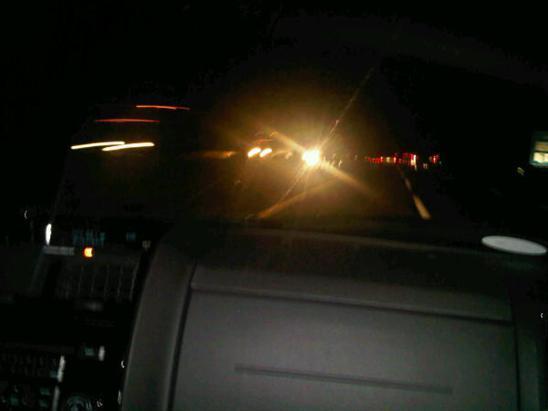
Where is `light`? The height and width of the screenshot is (411, 548). light is located at coordinates (312, 161).